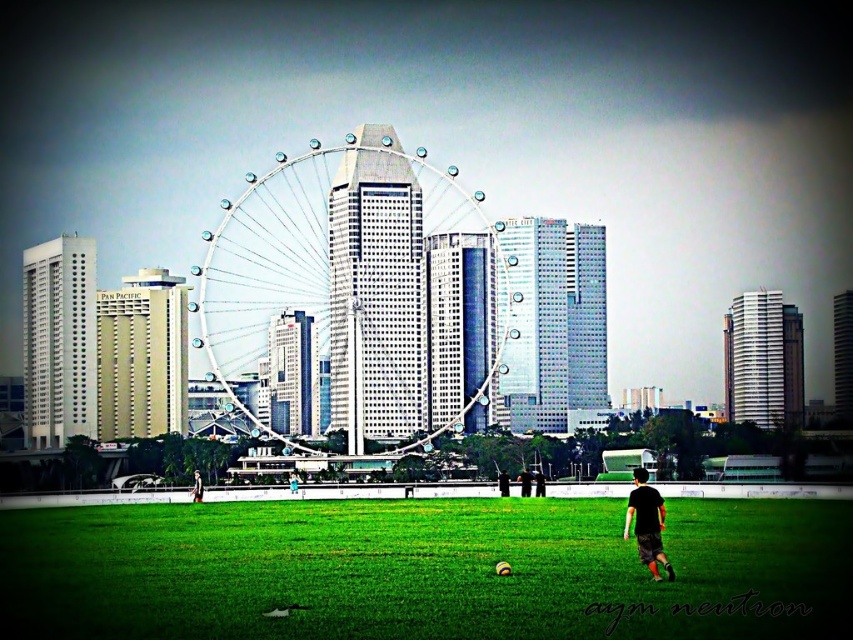
Does black matte shirt at lower right appear over black fabric shirt at lower center?

Actually, black matte shirt at lower right is below black fabric shirt at lower center.

Does black matte shirt at lower right have a lesser width compared to black fabric shirt at lower center?

Incorrect, black matte shirt at lower right's width is not less than black fabric shirt at lower center's.

Does point (662, 500) come closer to viewer compared to point (192, 496)?

No.

At what (x,y) coordinates should I click in order to perform the action: click on black matte shirt at lower right. Please return your answer as a coordinate pair (x, y). This screenshot has height=640, width=853. Looking at the image, I should click on (647, 524).

Can you confirm if green grass field at lower center is shorter than metallic silver ferris wheel at center?

Yes.

Who is lower down, green grass field at lower center or metallic silver ferris wheel at center?

green grass field at lower center is lower down.

Which is behind, point (688, 561) or point (454, 208)?

The point (688, 561) is more distant.

Find the location of `green grass field at lower center`. green grass field at lower center is located at coordinates (425, 570).

Is metallic silver ferris wheel at center below black fabric shirt at lower center?

Incorrect, metallic silver ferris wheel at center is not positioned below black fabric shirt at lower center.

Can you confirm if metallic silver ferris wheel at center is positioned to the left of black fabric shirt at lower center?

In fact, metallic silver ferris wheel at center is to the right of black fabric shirt at lower center.

Does point (234, 237) lie behind point (198, 472)?

No, it is not.

Where is `metallic silver ferris wheel at center`? metallic silver ferris wheel at center is located at coordinates (357, 300).